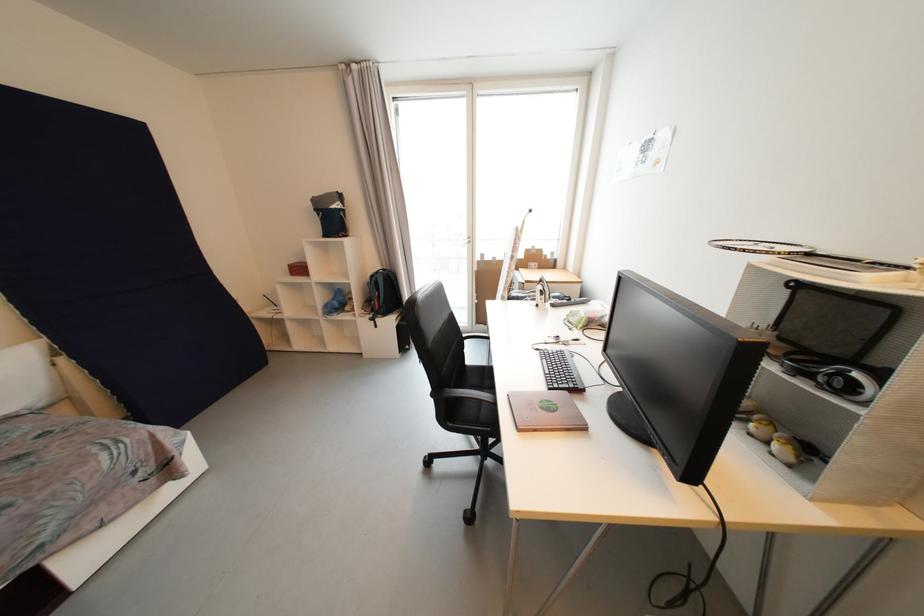
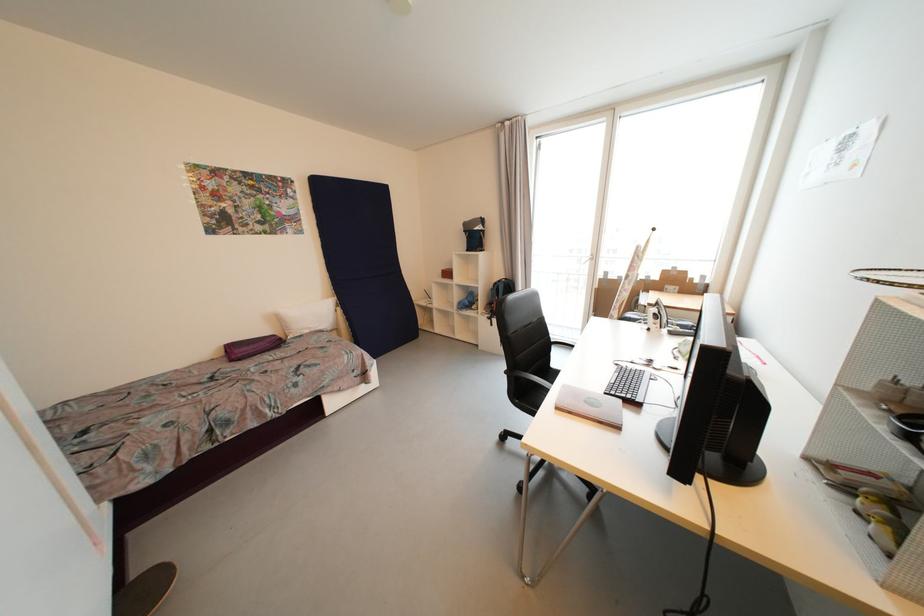
Where in the second image is the point corresponding to point 525,432 from the first image?

(562, 410)